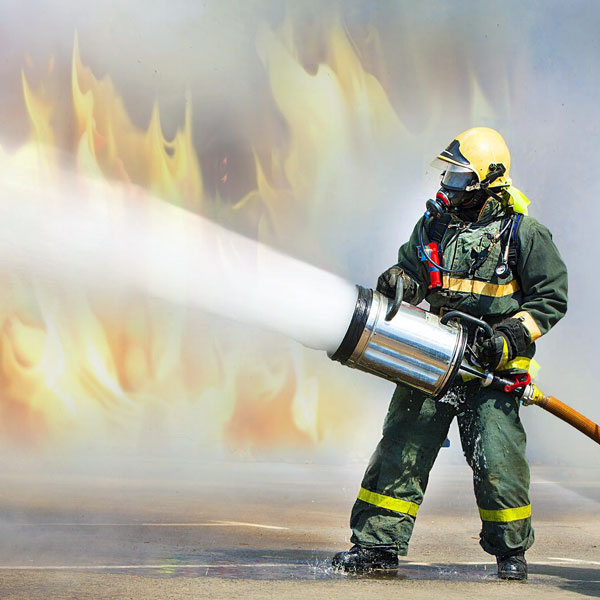
I want to click on huge fire extinguisher, so click(x=419, y=348).